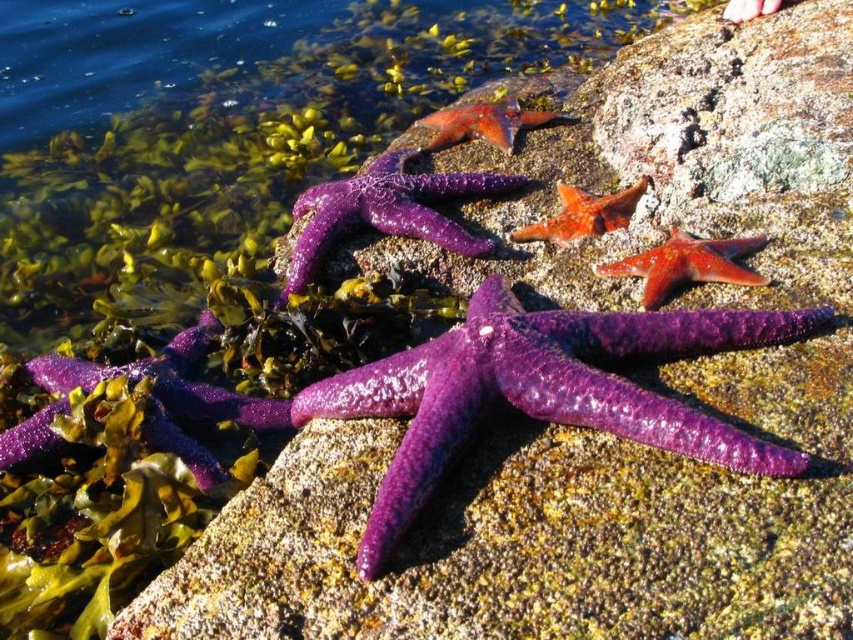
In the scene shown: Does purple shiny starfish at lower left have a greater height compared to purple glossy starfish at center?

In fact, purple shiny starfish at lower left may be shorter than purple glossy starfish at center.

Which of these two, purple shiny starfish at lower left or purple glossy starfish at center, stands shorter?

Standing shorter between the two is purple shiny starfish at lower left.

I want to click on purple shiny starfish at lower left, so click(149, 403).

The height and width of the screenshot is (640, 853). I want to click on purple shiny starfish at lower left, so click(x=149, y=403).

In the scene shown: Measure the distance between purple glossy starfish at center and camera.

The distance of purple glossy starfish at center from camera is 6.10 feet.

Based on the photo, is purple glossy starfish at center behind shiny orange starfish at center?

No, purple glossy starfish at center is in front of shiny orange starfish at center.

Is point (334, 204) closer to camera compared to point (576, 221)?

No.

The image size is (853, 640). Find the location of `purple glossy starfish at center`. purple glossy starfish at center is located at coordinates (386, 211).

Does smooth red starfish at center appear over shiny orange starfish at upper center?

Incorrect, smooth red starfish at center is not positioned above shiny orange starfish at upper center.

Is point (723, 282) closer to viewer compared to point (489, 124)?

Yes, it is.

At what (x,y) coordinates should I click in order to perform the action: click on smooth red starfish at center. Please return your answer as a coordinate pair (x, y). The width and height of the screenshot is (853, 640). Looking at the image, I should click on (686, 264).